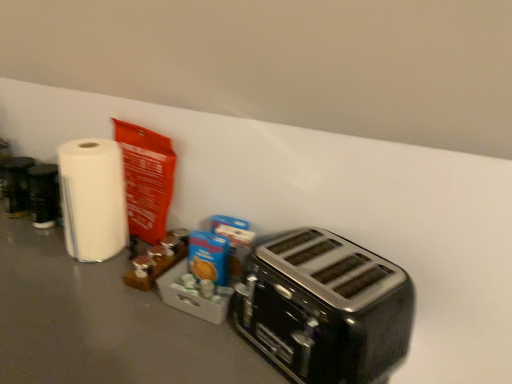
Where is `vacant area situated to the left side of black metallic toaster at lower right`? The height and width of the screenshot is (384, 512). vacant area situated to the left side of black metallic toaster at lower right is located at coordinates (183, 349).